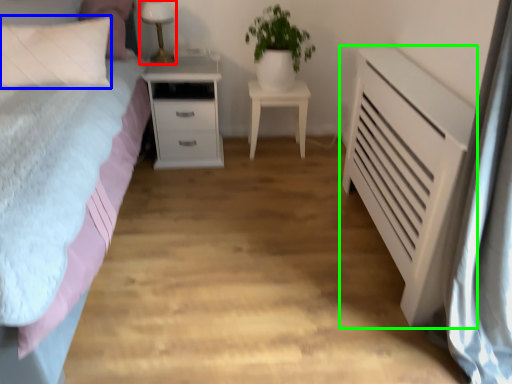
Question: Estimate the real-world distances between objects in this image. Which object is closer to table lamp (highlighted by a red box), pillow (highlighted by a blue box) or chest of drawers (highlighted by a green box)?

Choices:
 (A) pillow
 (B) chest of drawers

Answer: (A)